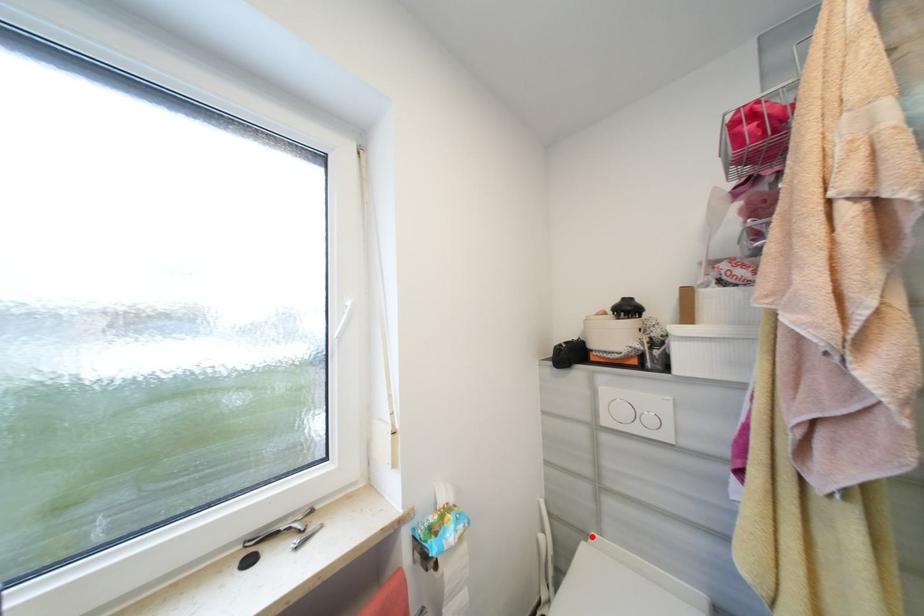
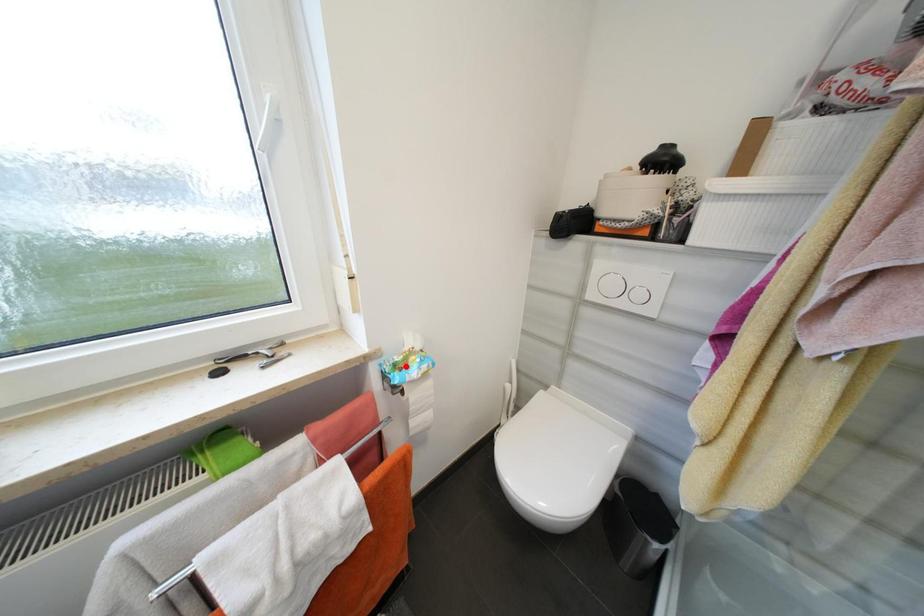
I am providing you with two images of the same scene from different viewpoints. A red point is marked on the first image and another point is marked on the second image. Does the point marked in image1 correspond to the same location as the one in image2?

No